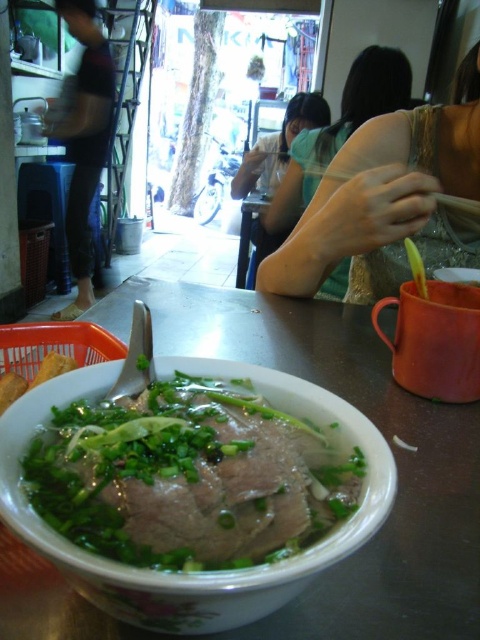
The height and width of the screenshot is (640, 480). What do you see at coordinates (190, 476) in the screenshot?
I see `white glossy stew at center` at bounding box center [190, 476].

Which is in front, point (237, 550) or point (423, 294)?

Point (237, 550)

Locate an element on the screen. white glossy stew at center is located at coordinates (190, 476).

Which is below, white glossy bowl at center or dark blue jeans at left?

white glossy bowl at center is lower down.

Which is more to the left, white glossy bowl at center or dark blue jeans at left?

dark blue jeans at left

Is point (468, 508) in front of point (72, 120)?

That is True.

You are a GUI agent. You are given a task and a screenshot of the screen. Output one action in this format:
    pyautogui.click(x=<x>, y=<y>)
    Task: Click on the white glossy bowl at center
    This screenshot has height=640, width=480.
    Given the screenshot: What is the action you would take?
    pyautogui.click(x=384, y=436)

Does point (415, 166) come closer to viewer compared to point (408, 241)?

No, (415, 166) is behind (408, 241).

Which is more to the right, green fabric shirt at upper right or yellow rubber spoon at upper right?

Positioned to the right is green fabric shirt at upper right.

Which is behind, point (348, 161) or point (423, 288)?

The point (348, 161) is more distant.

Where is `green fabric shirt at upper right`? The width and height of the screenshot is (480, 640). green fabric shirt at upper right is located at coordinates (388, 200).